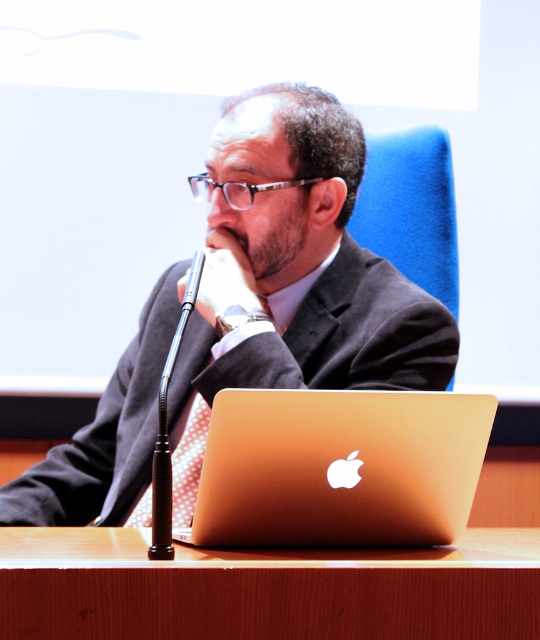
Question: Considering the real-world distances, which object is farthest from the gold metallic laptop at center?

Choices:
 (A) matte black suit at center
 (B) wooden table at center

Answer: (A)

Question: Does gold metallic laptop at center appear over red dotted tie at center?

Choices:
 (A) yes
 (B) no

Answer: (A)

Question: Estimate the real-world distances between objects in this image. Which object is closer to the gold metallic laptop at center?

Choices:
 (A) matte black suit at center
 (B) wooden table at center
 (C) red dotted tie at center

Answer: (B)

Question: Does matte black suit at center appear under gold metallic laptop at center?

Choices:
 (A) yes
 (B) no

Answer: (B)

Question: Which of the following is the closest to the observer?

Choices:
 (A) (408, 492)
 (B) (249, 362)

Answer: (A)

Question: Can you confirm if gold metallic laptop at center is positioned to the left of red dotted tie at center?

Choices:
 (A) no
 (B) yes

Answer: (A)